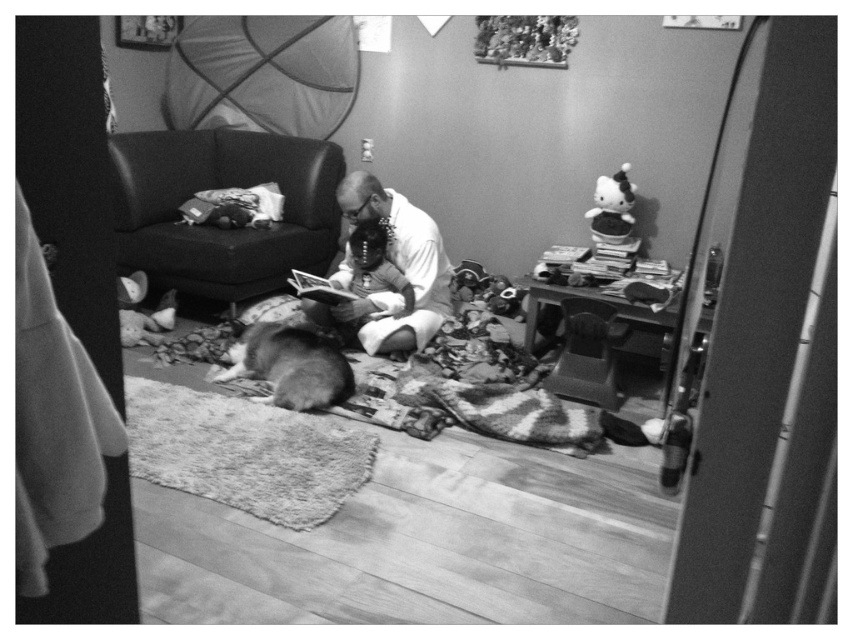
Question: Which point is farther from the camera taking this photo?

Choices:
 (A) (213, 234)
 (B) (254, 340)

Answer: (A)

Question: Is leather couch at center below fluffy white dog at center?

Choices:
 (A) yes
 (B) no

Answer: (B)

Question: Does leather couch at center appear over white matte shirt at center?

Choices:
 (A) yes
 (B) no

Answer: (A)

Question: Which object is closer to the camera taking this photo?

Choices:
 (A) leather couch at center
 (B) white matte shirt at center
 (C) fluffy white dog at center

Answer: (C)

Question: Is leather couch at center closer to the viewer compared to fluffy white dog at center?

Choices:
 (A) no
 (B) yes

Answer: (A)

Question: Estimate the real-world distances between objects in this image. Which object is farther from the fluffy white dog at center?

Choices:
 (A) leather couch at center
 (B) white matte shirt at center

Answer: (A)